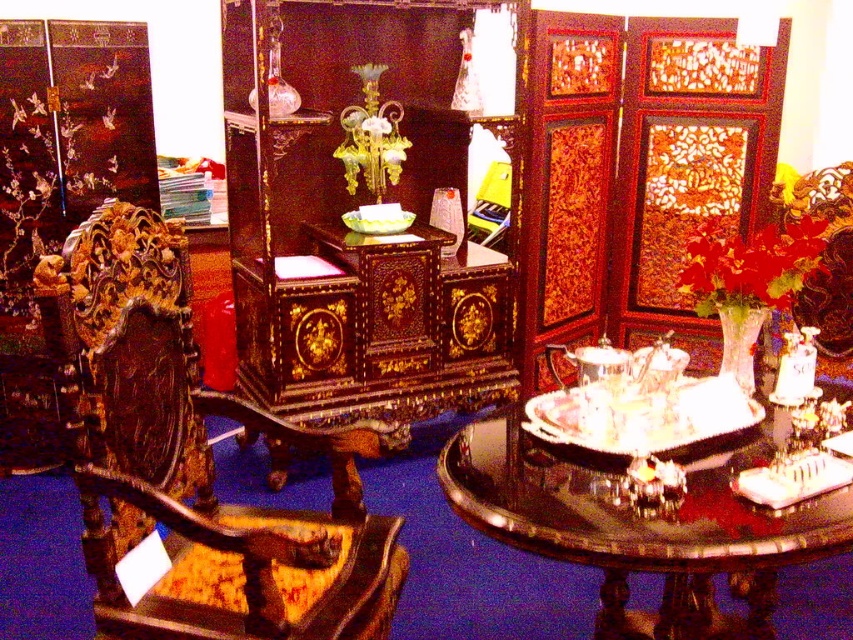
Question: Which object is closer to the camera taking this photo?

Choices:
 (A) glossy wood tray at center
 (B) polished wood armchair at left

Answer: (A)

Question: Which object appears closest to the camera in this image?

Choices:
 (A) polished wood armchair at left
 (B) glossy wood tray at center

Answer: (B)

Question: Is polished wood armchair at left above glossy wood tray at center?

Choices:
 (A) no
 (B) yes

Answer: (B)

Question: From the image, what is the correct spatial relationship of polished wood armchair at left in relation to glossy wood tray at center?

Choices:
 (A) right
 (B) left

Answer: (B)

Question: Which of the following is the closest to the observer?

Choices:
 (A) (73, 412)
 (B) (775, 572)

Answer: (A)

Question: Can you confirm if polished wood armchair at left is positioned above glossy wood tray at center?

Choices:
 (A) yes
 (B) no

Answer: (A)